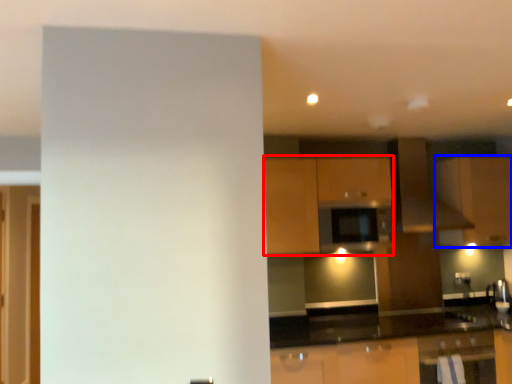
Question: Which object is further to the camera taking this photo, cabinetry (highlighted by a red box) or cabinetry (highlighted by a blue box)?

Choices:
 (A) cabinetry
 (B) cabinetry

Answer: (B)